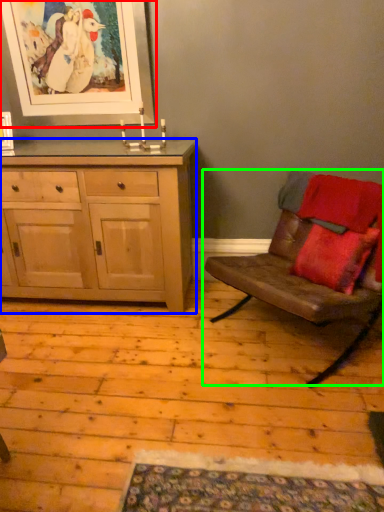
Question: Which object is the closest to the picture frame (highlighted by a red box)? Choose among these: cabinetry (highlighted by a blue box) or chair (highlighted by a green box).

Choices:
 (A) cabinetry
 (B) chair

Answer: (A)